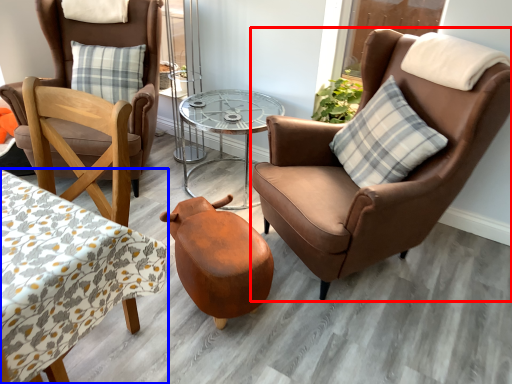
Question: Which object appears closest to the camera in this image, chair (highlighted by a red box) or coffee table (highlighted by a blue box)?

Choices:
 (A) chair
 (B) coffee table

Answer: (B)